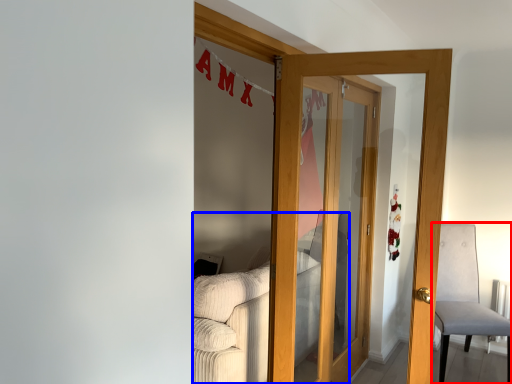
Question: Which object is closer to the camera taking this photo, chair (highlighted by a red box) or couch (highlighted by a blue box)?

Choices:
 (A) chair
 (B) couch

Answer: (B)